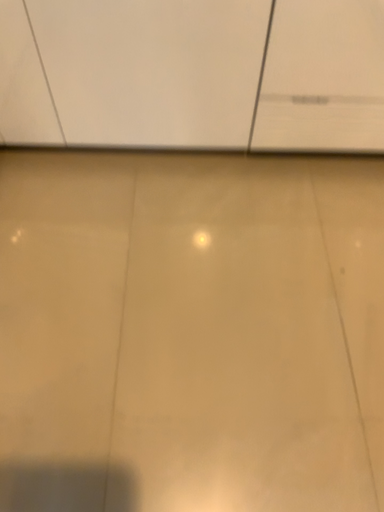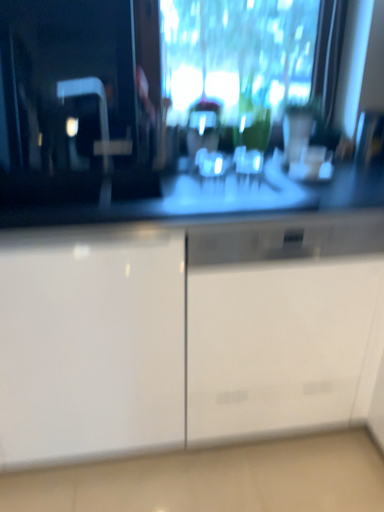
Question: Which way did the camera rotate in the video?

Choices:
 (A) rotated downward
 (B) rotated upward

Answer: (B)